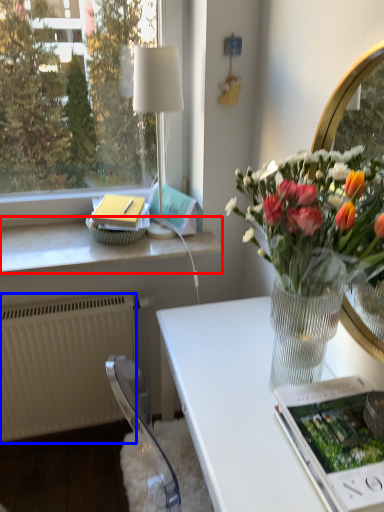
Question: Which object is closer to the camera taking this photo, window sill (highlighted by a red box) or radiator (highlighted by a blue box)?

Choices:
 (A) window sill
 (B) radiator

Answer: (A)